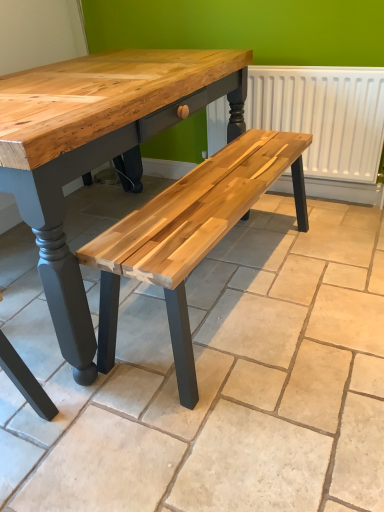
In order to click on vacant region below white matte radiator at upper right (from a real-world perspective) in this screenshot , I will do `click(308, 196)`.